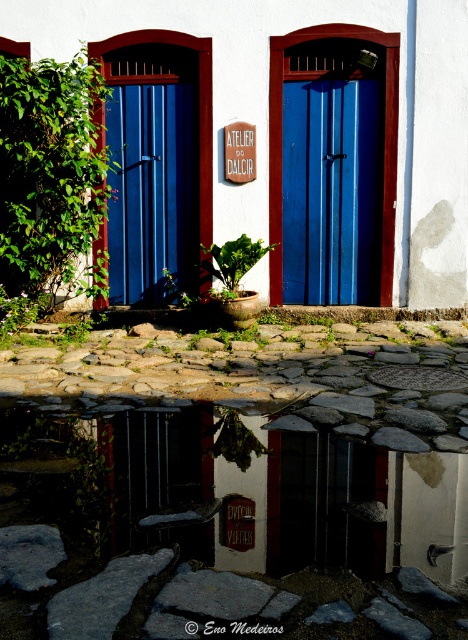
You are standing at the point with coordinates (234, 440) in the image. What object is located exactly at this point?

The green leafy plant at center is located exactly at the point with coordinates (234, 440).

You are a delivery person carrying a large package that is 40 inches wide. You need to pass between the blue wooden door at center and the green leafy plant at lower left to reach the entrance. Can you fit through the space between them?

The blue wooden door at center and green leafy plant at lower left are 39.07 inches apart. Since your package is 40 inches wide, it is slightly wider than the available space, so you cannot fit through the space between them.